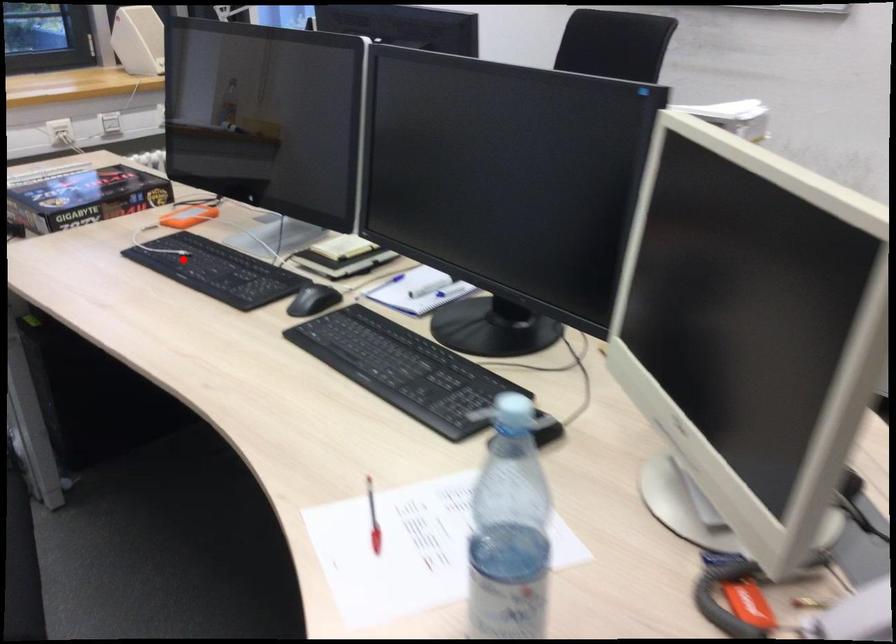
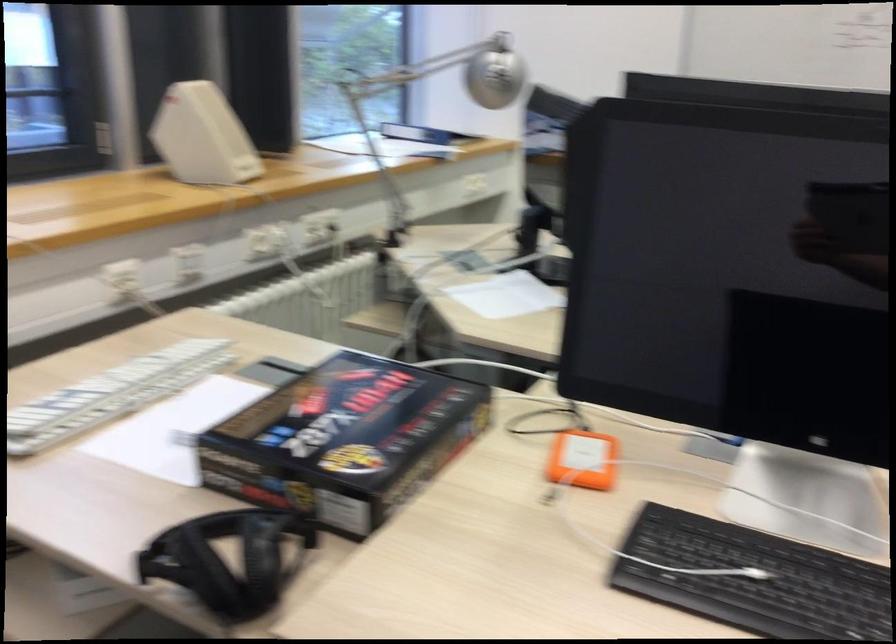
Question: I am providing you with two images of the same scene from different viewpoints. Image1 has a red point marked. In image2, the corresponding 3D location appears at what relative position? Reply with the corresponding letter.

Choices:
 (A) Closer
 (B) Farther

Answer: (A)